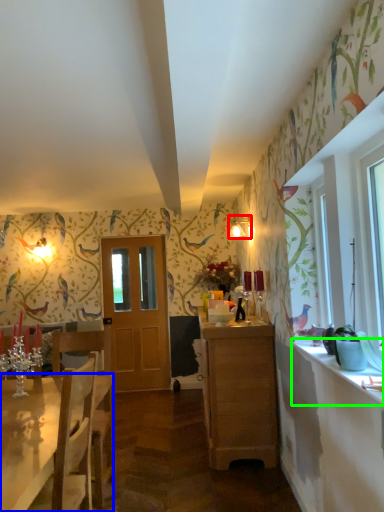
Question: Which is farther away from lamp (highlighted by a red box)? desk (highlighted by a blue box) or counter top (highlighted by a green box)?

Choices:
 (A) desk
 (B) counter top

Answer: (A)